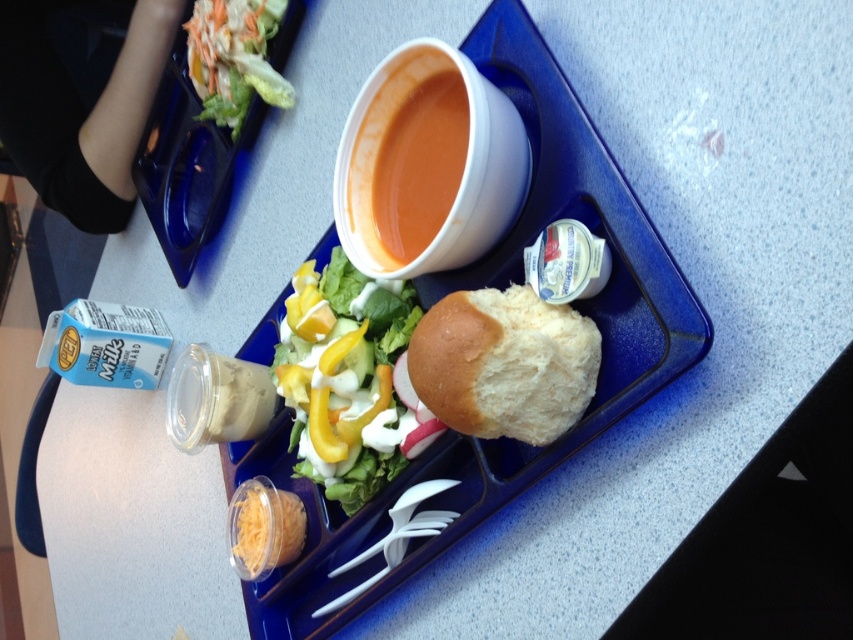
Consider the image. You are sitting at the table looking at the meal on the blue cafeteria tray. You want to reach for the orange matte soup at center without moving the fresh green salad at center. Is the soup accessible from your current position?

The orange matte soup at center is behind the fresh green salad at center, so it is blocked by the salad and not directly accessible without moving the salad.

You are a food delivery robot that needs to pick up the bread roll from the tray. The tray has a coordinate system where the bottom left corner is the origin. The bread roll is located at point (x=503, y=364). To ensure precise pickup, you must confirm the exact coordinates of the bread roll. What are the coordinates of the bread roll?

The coordinates of the bread roll are (x=503, y=364).

You are a food critic evaluating this meal. You notice that the bread roll is placed at point (345, 378) on the tray. What is located at that exact coordinate?

At point (345, 378) lies fresh green salad at center.